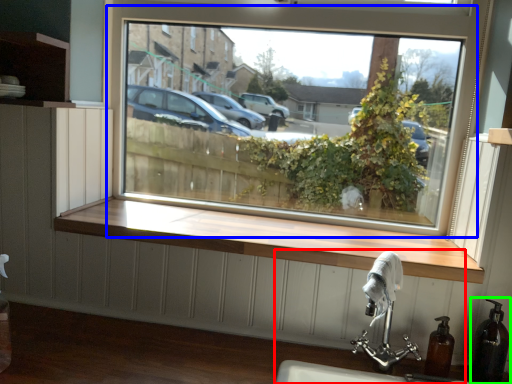
Question: Which is nearer to the sink (highlighted by a red box)? window (highlighted by a blue box) or soap dispenser (highlighted by a green box).

Choices:
 (A) window
 (B) soap dispenser

Answer: (B)